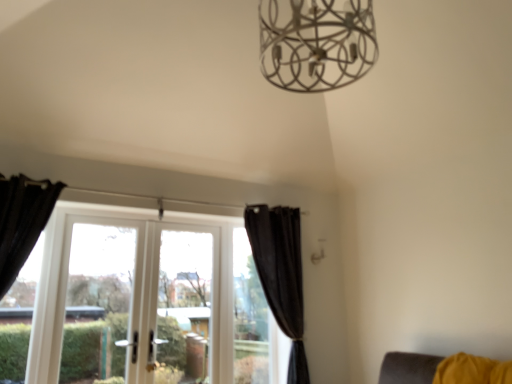
Question: From a real-world perspective, is transparent glass window at center, the 1th window in the right-to-left sequence, physically below transparent glass window at center?

Choices:
 (A) yes
 (B) no

Answer: (A)

Question: Does transparent glass window at center, placed as the second window when sorted from left to right, have a lesser width compared to transparent glass window at center?

Choices:
 (A) no
 (B) yes

Answer: (B)

Question: Considering the relative positions of transparent glass window at center, the 1th window in the right-to-left sequence, and transparent glass window at center in the image provided, is transparent glass window at center, the 1th window in the right-to-left sequence, to the left of transparent glass window at center from the viewer's perspective?

Choices:
 (A) no
 (B) yes

Answer: (A)

Question: Is transparent glass window at center, placed as the second window when sorted from left to right, positioned beyond the bounds of transparent glass window at center?

Choices:
 (A) no
 (B) yes

Answer: (B)

Question: Can you confirm if transparent glass window at center, placed as the second window when sorted from left to right, is bigger than transparent glass window at center?

Choices:
 (A) no
 (B) yes

Answer: (A)

Question: Does point (465, 367) appear closer or farther from the camera than point (177, 296)?

Choices:
 (A) closer
 (B) farther

Answer: (A)

Question: Considering the positions of yellow fabric chair at lower right and white glass window at center, the second window positioned from the right, in the image, is yellow fabric chair at lower right wider or thinner than white glass window at center, the second window positioned from the right,?

Choices:
 (A) thin
 (B) wide

Answer: (B)

Question: From a real-world perspective, is yellow fabric chair at lower right positioned above or below white glass window at center, the first window viewed from the left?

Choices:
 (A) below
 (B) above

Answer: (A)

Question: From the image's perspective, is yellow fabric chair at lower right located above or below white glass window at center, the second window positioned from the right?

Choices:
 (A) below
 (B) above

Answer: (A)

Question: From a real-world perspective, is transparent glass window at center positioned above or below transparent glass window at center, the 1th window in the right-to-left sequence?

Choices:
 (A) above
 (B) below

Answer: (A)

Question: Looking at the image, does transparent glass window at center seem bigger or smaller compared to transparent glass window at center, placed as the second window when sorted from left to right?

Choices:
 (A) small
 (B) big

Answer: (B)

Question: Is transparent glass window at center situated inside transparent glass window at center, the 1th window in the right-to-left sequence, or outside?

Choices:
 (A) inside
 (B) outside

Answer: (B)

Question: Is point (207, 352) positioned closer to the camera than point (260, 311)?

Choices:
 (A) farther
 (B) closer

Answer: (B)

Question: Looking at their shapes, would you say white glass window at center, the second window positioned from the right, is wider or thinner than black velvet curtain at center, which appears as the 1th curtain when viewed from the back?

Choices:
 (A) thin
 (B) wide

Answer: (A)

Question: Considering the positions of point (200, 292) and point (272, 314), is point (200, 292) closer or farther from the camera than point (272, 314)?

Choices:
 (A) closer
 (B) farther

Answer: (A)